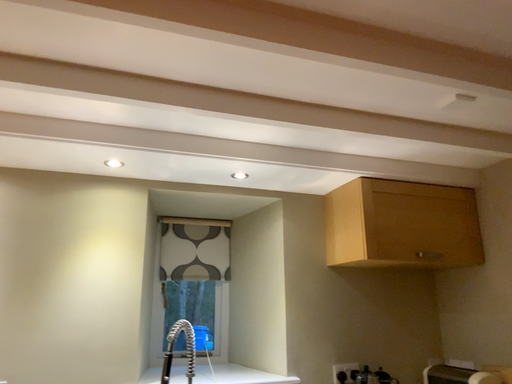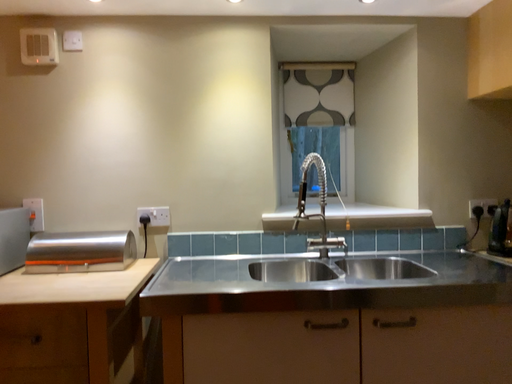
Question: Which way did the camera rotate in the video?

Choices:
 (A) rotated right
 (B) rotated left

Answer: (B)